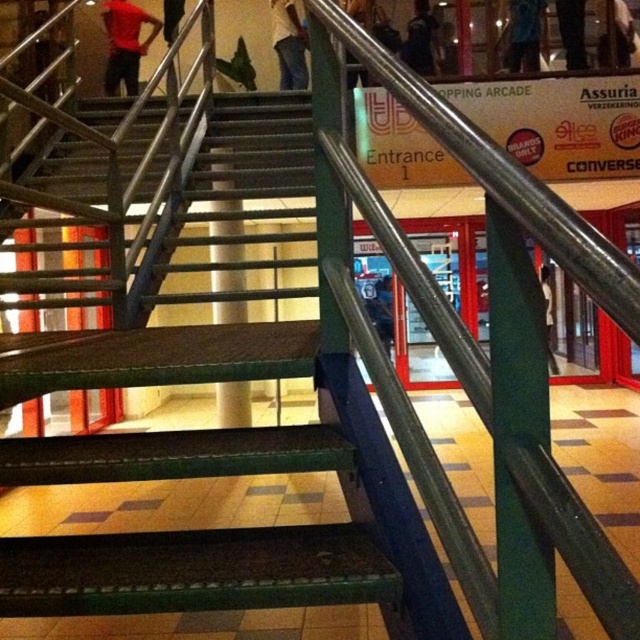
Question: Can you confirm if blue shirt at upper center is positioned above dark blue jeans at upper center?

Choices:
 (A) yes
 (B) no

Answer: (A)

Question: Which point appears closest to the camera in this image?

Choices:
 (A) (221, 317)
 (B) (300, 76)

Answer: (A)

Question: Which point is closer to the camera?

Choices:
 (A) (435, 70)
 (B) (570, 68)
 (C) (156, 29)

Answer: (B)

Question: Is red matte shirt at upper left wider than blue shirt at upper center?

Choices:
 (A) no
 (B) yes

Answer: (B)

Question: Which point is closer to the camera?

Choices:
 (A) (403, 56)
 (B) (541, 10)
 (C) (131, 92)
 (D) (269, 12)

Answer: (B)

Question: Is green metal stair at center behind red matte shirt at upper left?

Choices:
 (A) yes
 (B) no

Answer: (B)